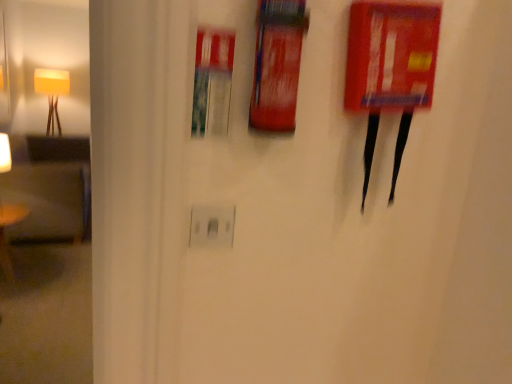
Question: Is yellow fabric lampshade at left further to the viewer compared to red plastic fire extinguisher at upper right?

Choices:
 (A) no
 (B) yes

Answer: (B)

Question: Does yellow fabric lampshade at left have a larger size compared to red plastic fire extinguisher at upper right?

Choices:
 (A) no
 (B) yes

Answer: (B)

Question: From the image's perspective, would you say yellow fabric lampshade at left is positioned over red plastic fire extinguisher at upper right?

Choices:
 (A) no
 (B) yes

Answer: (B)

Question: From a real-world perspective, is yellow fabric lampshade at left over red plastic fire extinguisher at upper right?

Choices:
 (A) yes
 (B) no

Answer: (B)

Question: Does yellow fabric lampshade at left turn towards red plastic fire extinguisher at upper right?

Choices:
 (A) no
 (B) yes

Answer: (B)

Question: Is yellow fabric lampshade at left bigger or smaller than red matte fire extinguisher at upper center?

Choices:
 (A) small
 (B) big

Answer: (B)

Question: Relative to red matte fire extinguisher at upper center, is yellow fabric lampshade at left in front or behind?

Choices:
 (A) behind
 (B) front

Answer: (A)

Question: Is point (51, 77) positioned closer to the camera than point (279, 38)?

Choices:
 (A) closer
 (B) farther

Answer: (B)

Question: From the image's perspective, relative to red matte fire extinguisher at upper center, is yellow fabric lampshade at left above or below?

Choices:
 (A) above
 (B) below

Answer: (A)

Question: From a real-world perspective, relative to wooden table at left, is red plastic fire extinguisher at upper right vertically above or below?

Choices:
 (A) above
 (B) below

Answer: (A)

Question: Visually, is red plastic fire extinguisher at upper right positioned to the left or to the right of wooden table at left?

Choices:
 (A) left
 (B) right

Answer: (B)

Question: Does point (410, 59) appear closer or farther from the camera than point (11, 273)?

Choices:
 (A) farther
 (B) closer

Answer: (B)

Question: Considering their positions, is red plastic fire extinguisher at upper right located in front of or behind wooden table at left?

Choices:
 (A) behind
 (B) front

Answer: (B)

Question: Which is correct: white plastic electric outlet at center is inside yellow fabric lampshade at left, or outside of it?

Choices:
 (A) inside
 (B) outside

Answer: (B)

Question: In terms of height, does white plastic electric outlet at center look taller or shorter compared to yellow fabric lampshade at left?

Choices:
 (A) tall
 (B) short

Answer: (B)